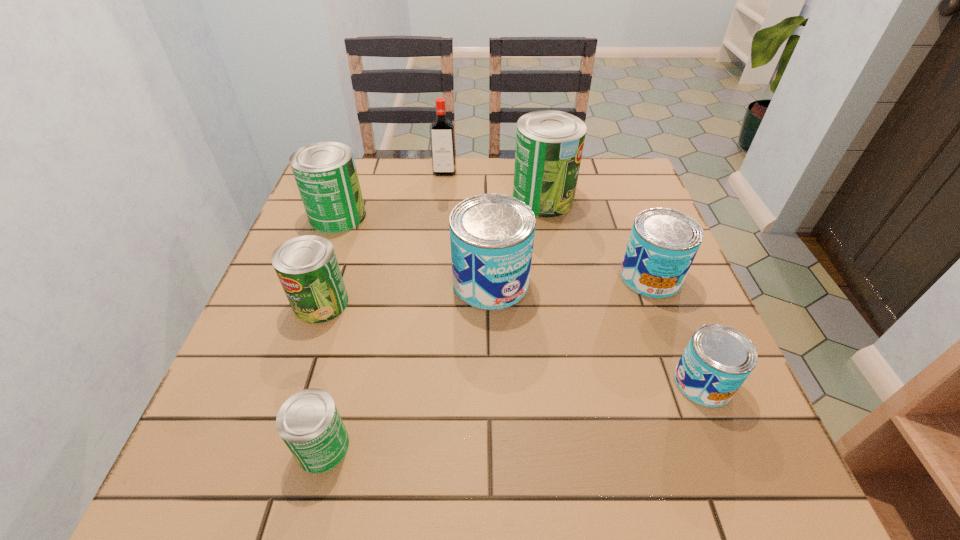
Locate an element on the screen. The image size is (960, 540). red vodka is located at coordinates (442, 133).

Locate an element on the screen. This screenshot has width=960, height=540. vodka is located at coordinates (442, 133).

Identify the location of the tallest can. The height and width of the screenshot is (540, 960). (549, 144).

In order to click on the rightmost green can in this screenshot , I will do `click(549, 144)`.

Image resolution: width=960 pixels, height=540 pixels. I want to click on the third smallest green can, so click(325, 172).

The width and height of the screenshot is (960, 540). In order to click on the biggest blue can in this screenshot , I will do `click(491, 235)`.

You are a GUI agent. You are given a task and a screenshot of the screen. Output one action in this format:
    pyautogui.click(x=<x>, y=<y>)
    Task: Click on the second smallest blue can
    This screenshot has height=540, width=960.
    Given the screenshot: What is the action you would take?
    pyautogui.click(x=663, y=243)

This screenshot has width=960, height=540. Identify the location of the third biggest green can. (307, 267).

At what (x,y) coordinates should I click in order to perform the action: click on the nearest blue can. Please return your answer as a coordinate pair (x, y). The height and width of the screenshot is (540, 960). Looking at the image, I should click on (718, 359).

You are a GUI agent. You are given a task and a screenshot of the screen. Output one action in this format:
    pyautogui.click(x=<x>, y=<y>)
    Task: Click on the seventh farthest object
    This screenshot has height=540, width=960.
    Given the screenshot: What is the action you would take?
    pyautogui.click(x=718, y=359)